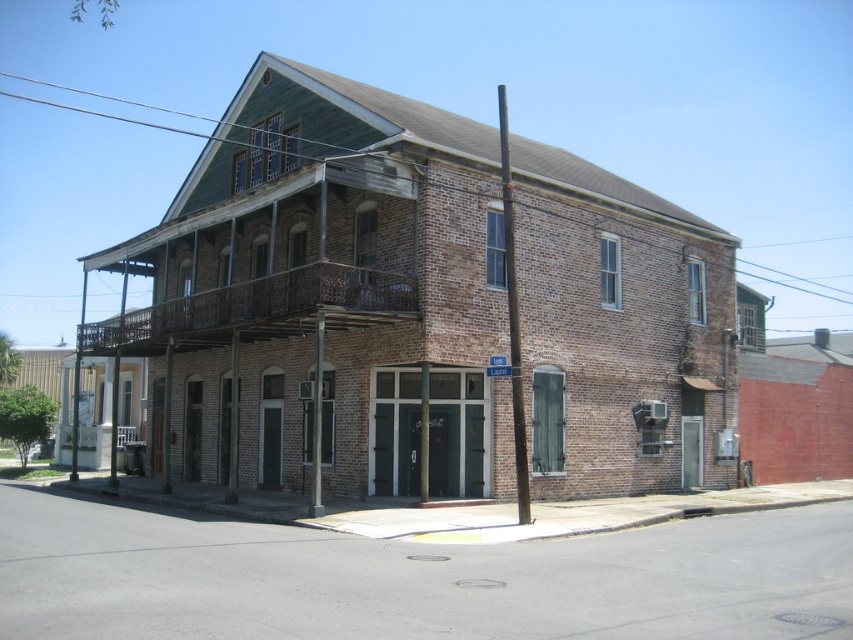
You are standing at the front entrance of the two story brick building and want to locate the smooth gray pole at center. Based on the 2D coordinates provided, where should you look relative to the entrance?

The smooth gray pole at center is located at 2D coordinates point (514,320), which is directly in front of the entrance at the center of the building.

In the scene shown: You are standing in front of the two story brick building. There is a point at coordinate (258, 310). Which object is this point located on?

The point at coordinate (258, 310) is located on the rusty metal balcony at center.